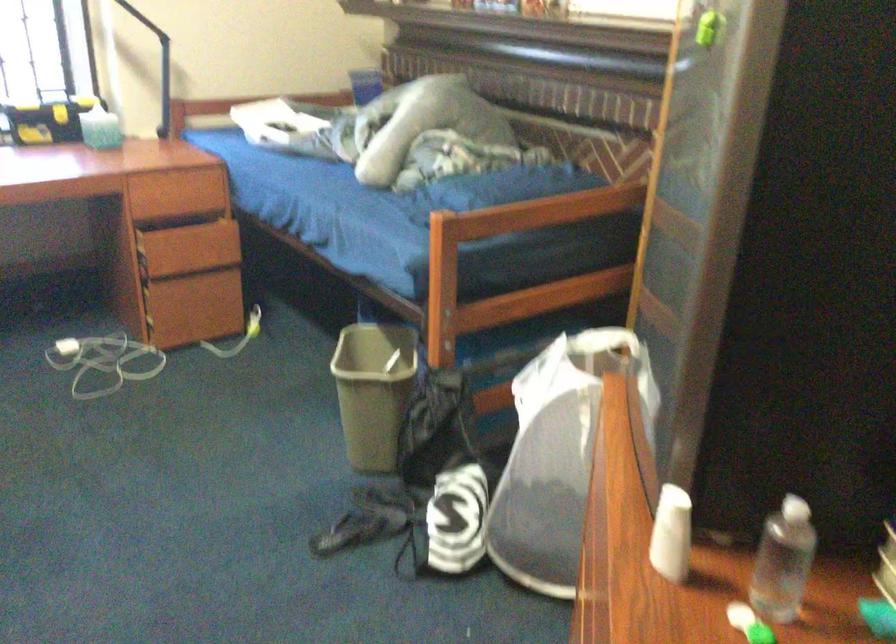
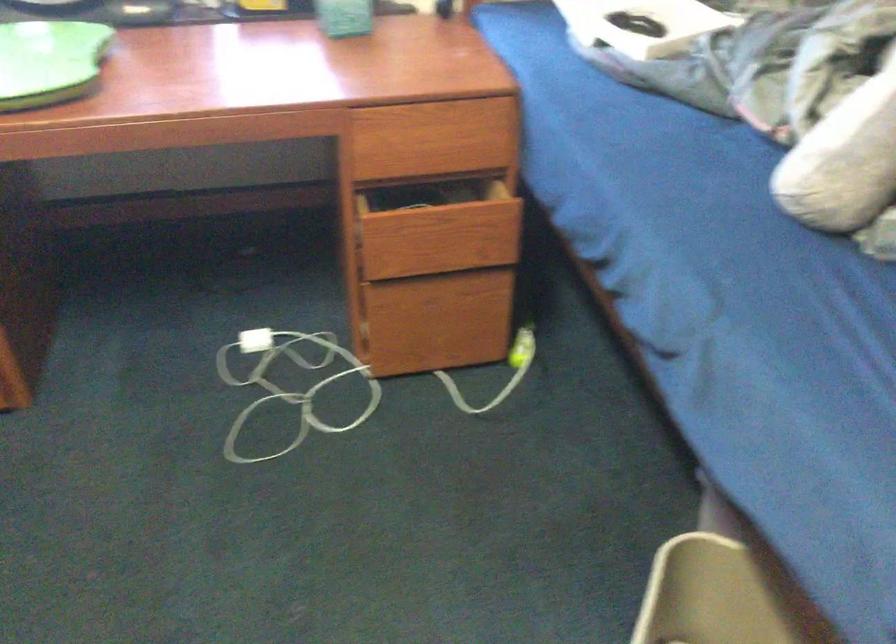
In the second image, find the point that corresponds to (x=248, y=324) in the first image.

(521, 346)